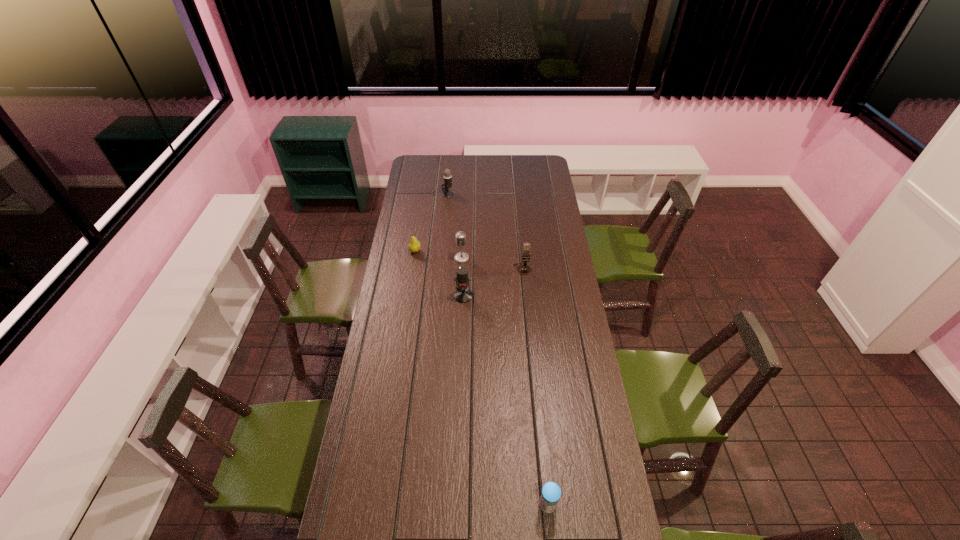
Locate an element on the screen. free space between the pear and the medicine is located at coordinates (481, 378).

This screenshot has height=540, width=960. I want to click on the fourth closest object relative to the medicine, so click(414, 246).

The height and width of the screenshot is (540, 960). In order to click on object that is the fifth closest to the leftmost microphone in this screenshot , I will do `click(551, 492)`.

Identify the location of microphone that is the third closest to the fifth farthest object. (447, 176).

This screenshot has width=960, height=540. I want to click on the closest microphone to the rightmost microphone, so click(x=463, y=294).

Identify the location of free location that satisfies the following two spatial constraints: 1. on the front side of the medicine; 2. on the left side of the pear. (376, 505).

At what (x,y) coordinates should I click in order to perform the action: click on vacant space that satisfies the following two spatial constraints: 1. on the side of the second nearest object with the red ring; 2. on the right side of the medicine. Please return your answer as a coordinate pair (x, y). The image size is (960, 540). Looking at the image, I should click on (456, 505).

Identify the location of vacant area in the image that satisfies the following two spatial constraints: 1. on the front-facing side of the nearest object; 2. on the left side of the rightmost microphone. The image size is (960, 540). (545, 505).